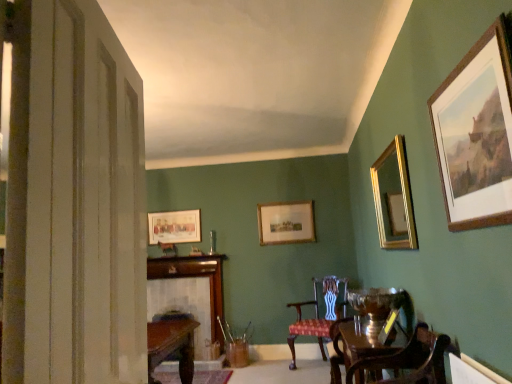
Question: Is wooden fireplace at center wider or thinner than shiny brown wood round table at lower right?

Choices:
 (A) wide
 (B) thin

Answer: (B)

Question: In the image, is wooden fireplace at center positioned in front of or behind shiny brown wood round table at lower right?

Choices:
 (A) behind
 (B) front

Answer: (A)

Question: Estimate the real-world distances between objects in this image. Which object is farther from the wooden framed picture at center, the third picture frame positioned from the front?

Choices:
 (A) gold/gilded mirror at upper right, which ranks as the 4th picture frame in left-to-right order
 (B) mahogany wood chair at lower right, which ranks as the second chair in back-to-front order
 (C) matte gold picture frame at upper left, arranged as the 4th picture frame when viewed from the front
 (D) wooden picture frame at upper right, which is the third picture frame from left to right
 (E) red upholstered chair at center, positioned as the 2th chair in front-to-back order

Answer: (D)

Question: Which is farther from the gold/gilded mirror at upper right, which appears as the first picture frame when viewed from the right?

Choices:
 (A) red upholstered chair at center, marked as the first chair in a back-to-front arrangement
 (B) wooden framed picture at center, arranged as the second picture frame when viewed from the back
 (C) shiny brown wood round table at lower right
 (D) matte gold picture frame at upper left, which appears as the first picture frame when viewed from the left
 (E) wooden picture frame at upper right, which is the 4th picture frame in back-to-front order

Answer: (D)